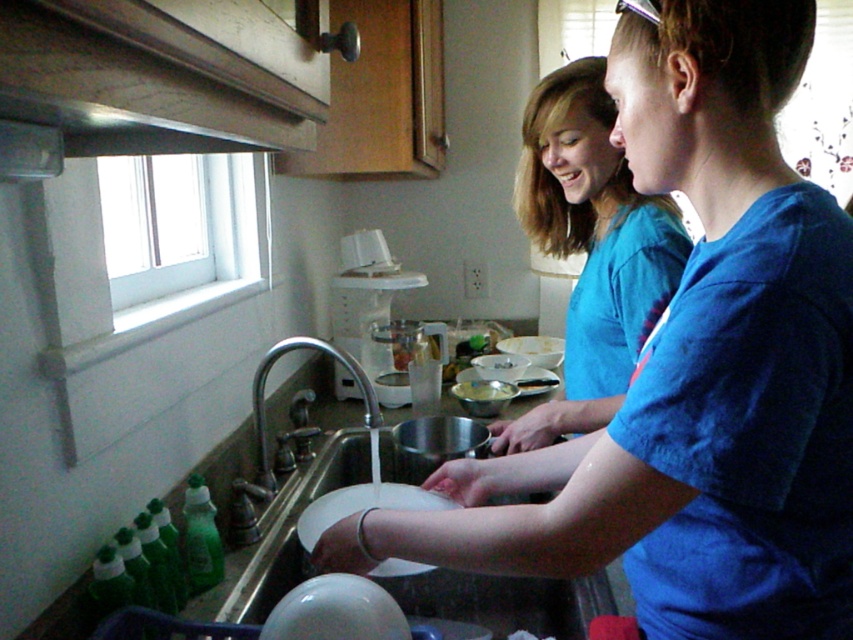
Question: Which object is farther from the camera taking this photo?

Choices:
 (A) blue cotton shirt at upper right
 (B) blue cotton shirt at center
 (C) silver metallic faucet at sink left

Answer: (B)

Question: Which point appears closest to the camera in this image?

Choices:
 (A) pyautogui.click(x=352, y=488)
 (B) pyautogui.click(x=589, y=417)
 (C) pyautogui.click(x=619, y=12)

Answer: (C)

Question: Is white matte plate at sink positioned behind silver metallic faucet at sink left?

Choices:
 (A) yes
 (B) no

Answer: (B)

Question: Can you confirm if blue cotton shirt at upper right is smaller than blue cotton shirt at center?

Choices:
 (A) no
 (B) yes

Answer: (A)

Question: Observing the image, what is the correct spatial positioning of blue cotton shirt at center in reference to white matte plate at sink?

Choices:
 (A) below
 (B) above

Answer: (B)

Question: Which is farther from the silver metallic faucet at sink left?

Choices:
 (A) white matte plate at sink
 (B) blue cotton shirt at upper right

Answer: (B)